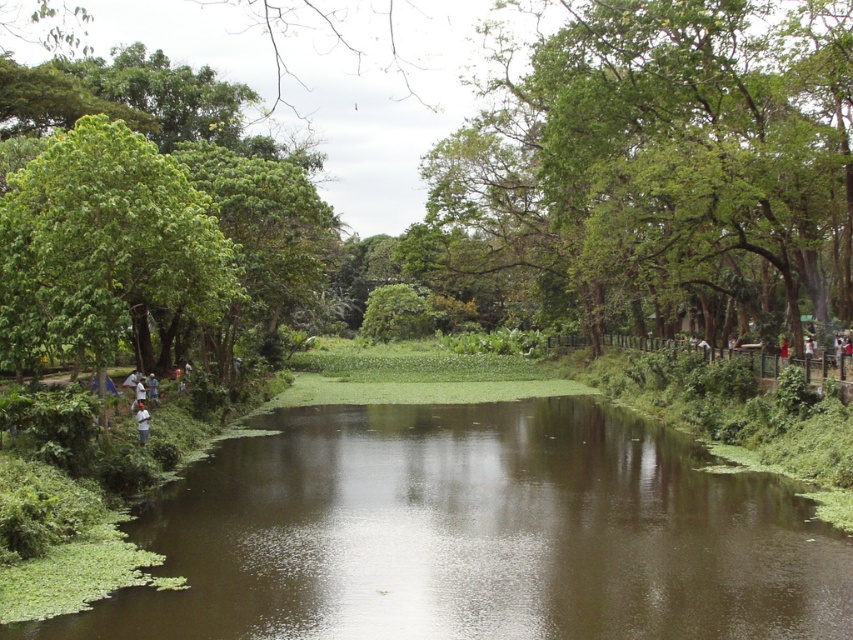
Question: Can you confirm if green leafy tree at upper center is positioned below white cotton shirt at lower left?

Choices:
 (A) no
 (B) yes

Answer: (A)

Question: Can you confirm if brown murky water at center is positioned to the left of green leafy tree at upper center?

Choices:
 (A) no
 (B) yes

Answer: (B)

Question: Which is nearer to the green leafy tree at upper center?

Choices:
 (A) white cotton shirt at lower left
 (B) green leafy tree at left

Answer: (B)

Question: Which object is the closest to the green leafy tree at upper center?

Choices:
 (A) green leafy tree at left
 (B) brown murky water at center

Answer: (B)

Question: Which object is farther from the camera taking this photo?

Choices:
 (A) green leafy tree at left
 (B) brown murky water at center
 (C) green leafy tree at upper center

Answer: (C)

Question: Does green leafy tree at upper center have a lesser width compared to white cotton shirt at lower left?

Choices:
 (A) yes
 (B) no

Answer: (B)